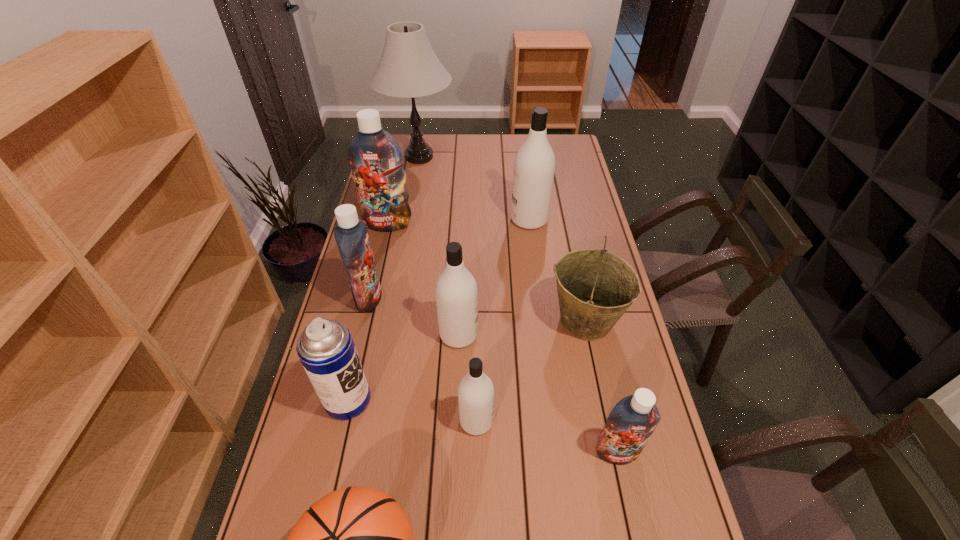
Where is `free spot located 0.280m on the front label of the third farthest shampoo`? free spot located 0.280m on the front label of the third farthest shampoo is located at coordinates (467, 298).

Where is `vacant space situated 0.370m on the front-facing side of the second nearest white shampoo`? This screenshot has width=960, height=540. vacant space situated 0.370m on the front-facing side of the second nearest white shampoo is located at coordinates (599, 334).

Where is `vacant space located on the left of the wine bucket`? This screenshot has width=960, height=540. vacant space located on the left of the wine bucket is located at coordinates (507, 321).

Where is `vacant space located on the label side of the aerosol can`? The image size is (960, 540). vacant space located on the label side of the aerosol can is located at coordinates (481, 400).

Identify the location of vacant region located on the front-facing side of the smallest white shampoo. (516, 421).

Locate an element on the screen. blank space located on the front label of the rightmost blue shampoo is located at coordinates (630, 510).

The height and width of the screenshot is (540, 960). I want to click on object at the far edge, so coord(408,68).

The width and height of the screenshot is (960, 540). Identify the location of lamp present at the left edge. (408, 68).

Find the location of `aerosol can that is at the left edge`. aerosol can that is at the left edge is located at coordinates (326, 349).

Find the location of a particular element. This screenshot has height=540, width=960. wine bucket that is at the right edge is located at coordinates (595, 287).